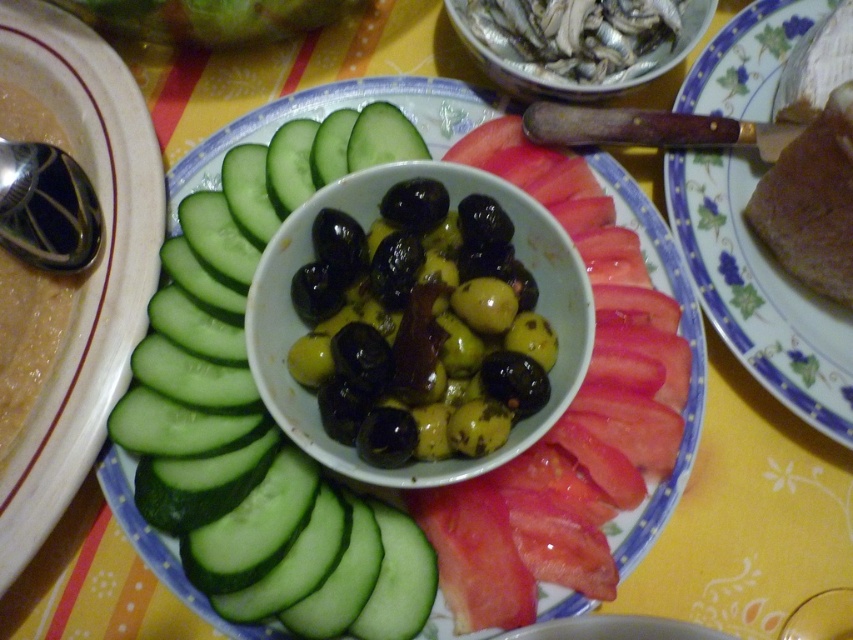
Question: Which point is closer to the camera taking this photo?

Choices:
 (A) (743, 74)
 (B) (291, 138)

Answer: (B)

Question: Can you confirm if green smooth cucumber at left is positioned to the right of brown matte bread at right?

Choices:
 (A) no
 (B) yes

Answer: (A)

Question: Which of the following is the closest to the observer?

Choices:
 (A) brown matte bread at right
 (B) green smooth cucumber at left

Answer: (B)

Question: Which point appears farthest from the camera in this image?

Choices:
 (A) (792, 352)
 (B) (260, 605)

Answer: (A)

Question: Does green smooth cucumber at left appear on the right side of brown matte bread at right?

Choices:
 (A) yes
 (B) no

Answer: (B)

Question: Can you confirm if green smooth cucumber at left is positioned to the left of brown matte bread at right?

Choices:
 (A) no
 (B) yes

Answer: (B)